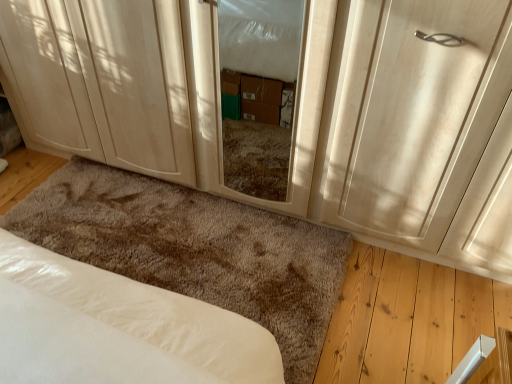
This screenshot has width=512, height=384. What do you see at coordinates (419, 129) in the screenshot?
I see `matte wood door at center` at bounding box center [419, 129].

The image size is (512, 384). What do you see at coordinates (103, 80) in the screenshot? I see `matte wood cabinet at lower left` at bounding box center [103, 80].

Describe the element at coordinates (119, 327) in the screenshot. I see `white soft bed at lower left` at that location.

Identify the location of matte wood door at center. (419, 129).

Considering the relative sizes of matte wood door at center and white soft bed at lower left in the image provided, is matte wood door at center wider than white soft bed at lower left?

In fact, matte wood door at center might be narrower than white soft bed at lower left.

Is matte wood door at center in front of or behind white soft bed at lower left in the image?

Visually, matte wood door at center is located in front of white soft bed at lower left.

Image resolution: width=512 pixels, height=384 pixels. I want to click on door above the white soft bed at lower left (from the image's perspective), so click(419, 129).

Considering the relative sizes of matte wood door at center and white soft bed at lower left in the image provided, is matte wood door at center smaller than white soft bed at lower left?

Correct, matte wood door at center occupies less space than white soft bed at lower left.

Is point (100, 2) farther from viewer compared to point (295, 165)?

No, (100, 2) is closer to viewer.

Would you consider matte wood cabinet at lower left to be distant from transparent glass screen door at center?

They are positioned close to each other.

Which of these two, matte wood cabinet at lower left or transparent glass screen door at center, is smaller?

With smaller size is transparent glass screen door at center.

Locate an element on the screen. cabinetry behind the transparent glass screen door at center is located at coordinates (103, 80).

From a real-world perspective, who is located lower, transparent glass screen door at center or matte wood door at center?

In real-world perspective, transparent glass screen door at center is lower.

Is transparent glass screen door at center inside or outside of matte wood door at center?

transparent glass screen door at center is outside matte wood door at center.

I want to click on door located above the transparent glass screen door at center (from a real-world perspective), so click(x=419, y=129).

Considering the relative positions of transparent glass screen door at center and matte wood door at center in the image provided, is transparent glass screen door at center to the right of matte wood door at center from the viewer's perspective?

In fact, transparent glass screen door at center is to the left of matte wood door at center.

The height and width of the screenshot is (384, 512). What are the coordinates of `screen door on the right of matte wood cabinet at lower left` in the screenshot? It's located at coord(220,102).

Is transparent glass screen door at center far away from matte wood cabinet at lower left?

transparent glass screen door at center is near matte wood cabinet at lower left, not far away.

From a real-world perspective, which object stands above the other?

In real-world perspective, transparent glass screen door at center is above.

Which is behind, point (450, 41) or point (45, 38)?

The point (45, 38) is behind.

Considering the sizes of objects matte wood door at center and matte wood cabinet at lower left in the image provided, who is bigger, matte wood door at center or matte wood cabinet at lower left?

With larger size is matte wood cabinet at lower left.

Is the surface of matte wood door at center in direct contact with matte wood cabinet at lower left?

No, matte wood door at center is not beside matte wood cabinet at lower left.

From a real-world perspective, is matte wood door at center physically located above or below matte wood cabinet at lower left?

matte wood door at center is above matte wood cabinet at lower left.

Visually, is white soft bed at lower left positioned to the left or to the right of matte wood door at center?

Based on their positions, white soft bed at lower left is located to the left of matte wood door at center.

Does white soft bed at lower left have a greater height compared to matte wood door at center?

Answer: In fact, white soft bed at lower left may be shorter than matte wood door at center.

Looking at this image, could you tell me if white soft bed at lower left is turned towards matte wood door at center?

No, white soft bed at lower left is not oriented towards matte wood door at center.

How distant is white soft bed at lower left from matte wood door at center?

They are 37.26 inches apart.

Can you tell me how much white soft bed at lower left and transparent glass screen door at center differ in facing direction?

The angular difference between white soft bed at lower left and transparent glass screen door at center is 88.2 degrees.

From the image's perspective, relative to transparent glass screen door at center, is white soft bed at lower left above or below?

Based on their image positions, white soft bed at lower left is located beneath transparent glass screen door at center.

Considering the relative sizes of white soft bed at lower left and transparent glass screen door at center in the image provided, is white soft bed at lower left bigger than transparent glass screen door at center?

Yes.

Which is farther from the camera, (280, 376) or (297, 127)?

The point (297, 127) is farther from the camera.

The image size is (512, 384). Identify the location of door that is in front of the white soft bed at lower left. pyautogui.click(x=419, y=129).

Locate an element on the screen. This screenshot has height=384, width=512. screen door below the matte wood cabinet at lower left (from the image's perspective) is located at coordinates (220, 102).

Based on their spatial positions, is white soft bed at lower left or transparent glass screen door at center further from matte wood door at center?

Among the two, white soft bed at lower left is located further to matte wood door at center.

When comparing their distances from matte wood door at center, does transparent glass screen door at center or matte wood cabinet at lower left seem further?

matte wood cabinet at lower left is positioned further to the anchor matte wood door at center.

When comparing their distances from transparent glass screen door at center, does matte wood cabinet at lower left or white soft bed at lower left seem further?

Based on the image, white soft bed at lower left appears to be further to transparent glass screen door at center.

From the image, which object appears to be nearer to matte wood door at center, transparent glass screen door at center or white soft bed at lower left?

transparent glass screen door at center is closer to matte wood door at center.

Looking at the image, which one is located further to transparent glass screen door at center, matte wood cabinet at lower left or matte wood door at center?

matte wood cabinet at lower left.

Looking at the image, which one is located closer to transparent glass screen door at center, matte wood door at center or white soft bed at lower left?

Based on the image, matte wood door at center appears to be nearer to transparent glass screen door at center.

Based on their spatial positions, is matte wood cabinet at lower left or transparent glass screen door at center closer to matte wood door at center?

The object closer to matte wood door at center is transparent glass screen door at center.

From the image, which object appears to be farther from matte wood cabinet at lower left, matte wood door at center or white soft bed at lower left?

matte wood door at center is positioned further to the anchor matte wood cabinet at lower left.

The height and width of the screenshot is (384, 512). In order to click on screen door between white soft bed at lower left and matte wood door at center from left to right in this screenshot , I will do `click(220, 102)`.

Locate an element on the screen. Image resolution: width=512 pixels, height=384 pixels. bed situated between matte wood cabinet at lower left and transparent glass screen door at center from left to right is located at coordinates (119, 327).

Where is `screen door located between matte wood cabinet at lower left and matte wood door at center in the left-right direction`? This screenshot has width=512, height=384. screen door located between matte wood cabinet at lower left and matte wood door at center in the left-right direction is located at coordinates [220, 102].

I want to click on bed located between matte wood cabinet at lower left and matte wood door at center in the left-right direction, so click(119, 327).